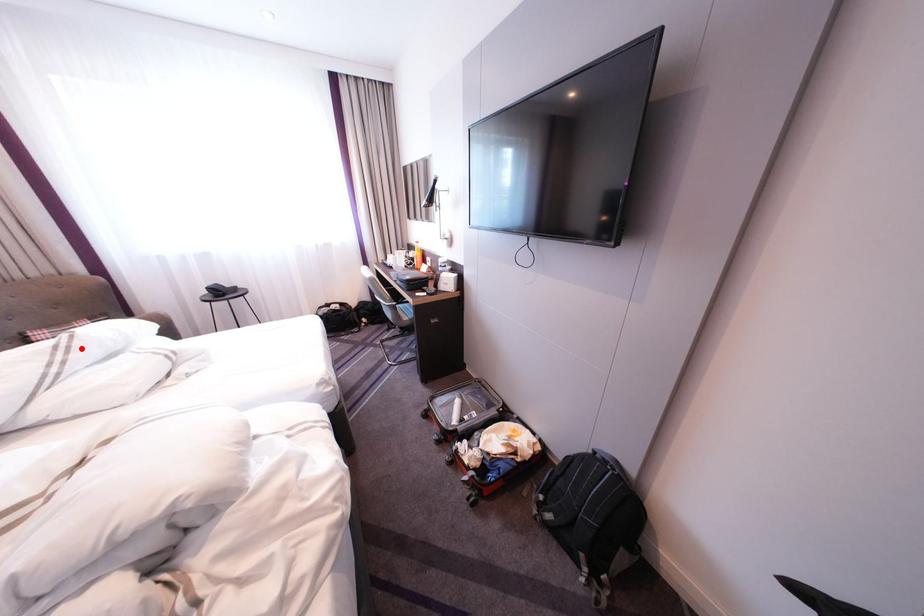
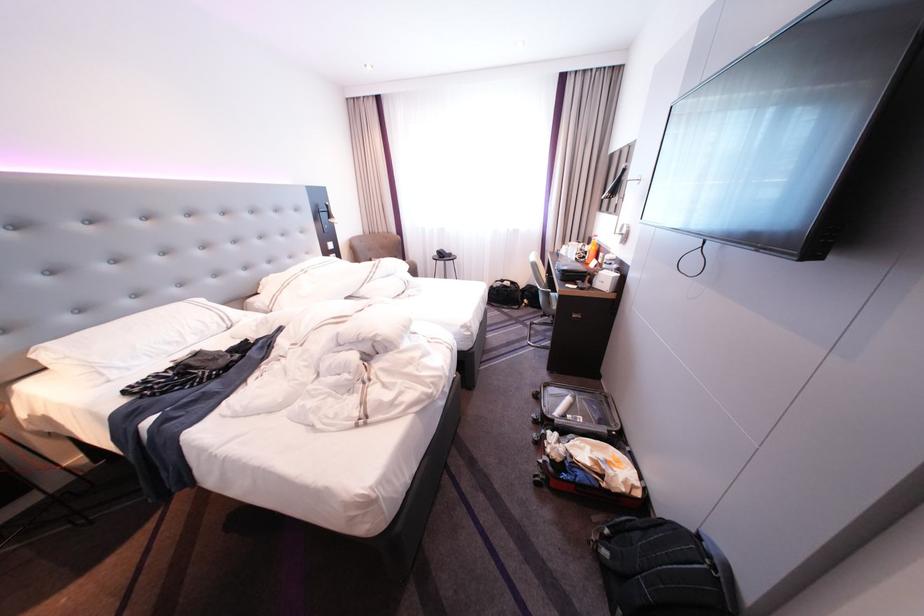
In the second image, find the point that corresponds to the highlighted location in the first image.

(390, 267)